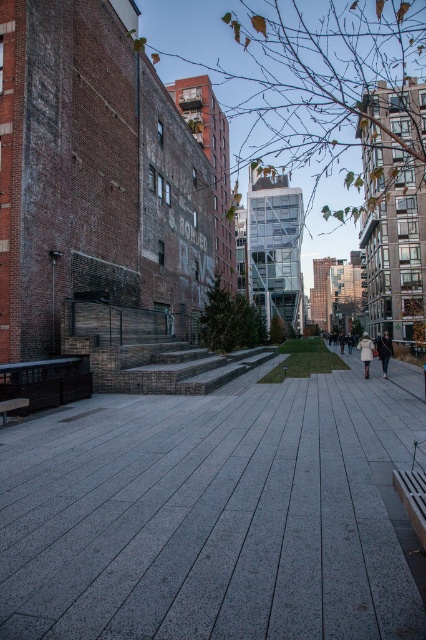
You are a pedestrian walking on the walkway and want to sit down. You see the wooden park bench at lower right and the white wool coat at right. Which object is closer to the brick steps on the left side of the walkway?

The wooden park bench at lower right is positioned over the white wool coat at right, meaning the bench is closer to the brick steps on the left side of the walkway than the coat.

You are a person who wants to sit on the wooden park bench at lower right. Can you sit there without the white wool coat at right blocking your view?

The wooden park bench at lower right is not as tall as the white wool coat at right, so the coat might block your view when sitting on the bench.